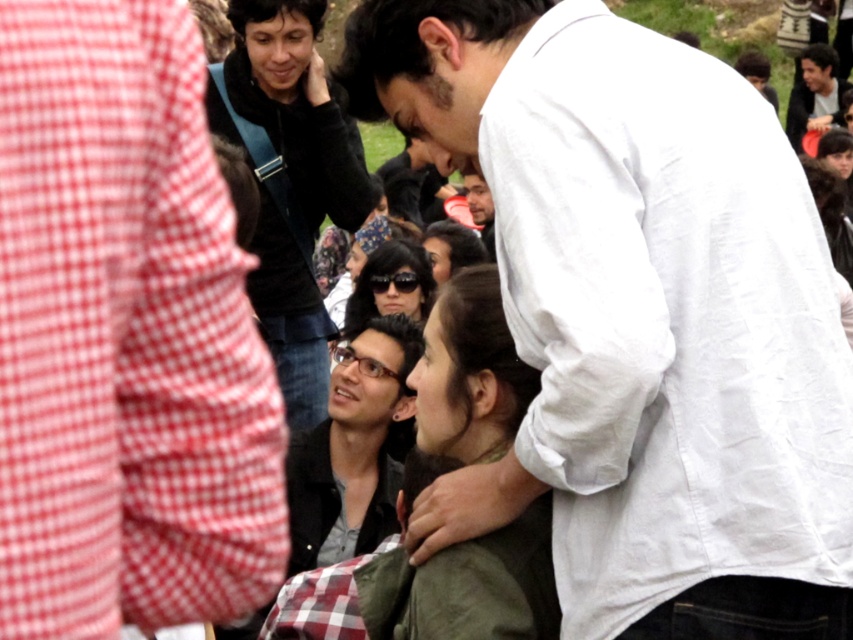
How far apart are white cotton shirt at upper right and matte black glasses at center?

A distance of 6.28 meters exists between white cotton shirt at upper right and matte black glasses at center.

The width and height of the screenshot is (853, 640). Identify the location of white cotton shirt at upper right. (639, 316).

What do you see at coordinates (639, 316) in the screenshot? I see `white cotton shirt at upper right` at bounding box center [639, 316].

Image resolution: width=853 pixels, height=640 pixels. I want to click on white cotton shirt at upper right, so click(x=639, y=316).